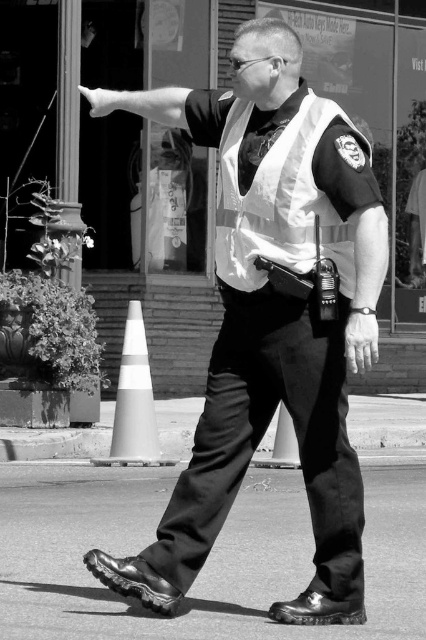
Who is more forward, (362, 314) or (91, 115)?

Point (362, 314) is more forward.

How much distance is there between smooth skin hand at center and matte black hand at upper left?

The distance of smooth skin hand at center from matte black hand at upper left is 5.90 feet.

Does point (347, 330) come behind point (173, 90)?

No, (347, 330) is in front of (173, 90).

I want to click on smooth skin hand at center, so click(360, 339).

Can you confirm if metallic radio at upper right is bigger than smooth skin hand at center?

Correct, metallic radio at upper right is larger in size than smooth skin hand at center.

Between point (382, 236) and point (363, 316), which one is positioned in front?

Positioned in front is point (363, 316).

Find the location of a particular element. metallic radio at upper right is located at coordinates (356, 230).

Does matte black vest at center appear under shiny asphalt at lower center?

Actually, matte black vest at center is above shiny asphalt at lower center.

In the scene shown: Between matte black vest at center and shiny asphalt at lower center, which one has more height?

With more height is matte black vest at center.

You are a GUI agent. You are given a task and a screenshot of the screen. Output one action in this format:
    pyautogui.click(x=<x>, y=<y>)
    Task: Click on the matte black vest at center
    The height and width of the screenshot is (640, 426).
    Given the screenshot: What is the action you would take?
    pyautogui.click(x=271, y=321)

This screenshot has height=640, width=426. Find the location of `matte black vest at center`. matte black vest at center is located at coordinates (271, 321).